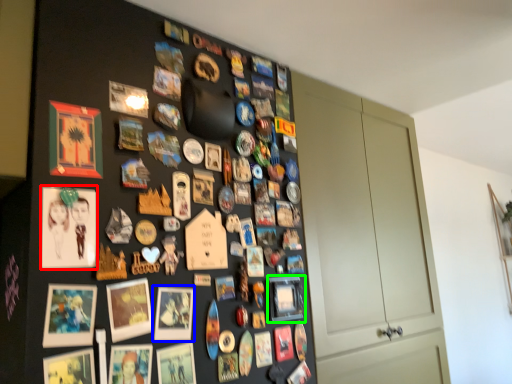
Question: Which is nearer to the picture frame (highlighted by a red box)? picture frame (highlighted by a blue box) or picture frame (highlighted by a green box).

Choices:
 (A) picture frame
 (B) picture frame

Answer: (A)